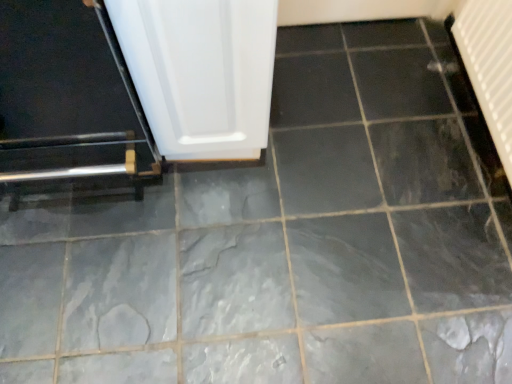
Question: Is white glossy door at center wider or thinner than metallic silver door at left?

Choices:
 (A) wide
 (B) thin

Answer: (B)

Question: Is white glossy door at center in front of or behind metallic silver door at left in the image?

Choices:
 (A) front
 (B) behind

Answer: (B)

Question: Based on their relative distances, which object is farther from the white glossy door at center?

Choices:
 (A) white textured radiator at upper right
 (B) metallic silver door at left

Answer: (A)

Question: Which object is the closest to the white textured radiator at upper right?

Choices:
 (A) metallic silver door at left
 (B) white glossy door at center

Answer: (B)